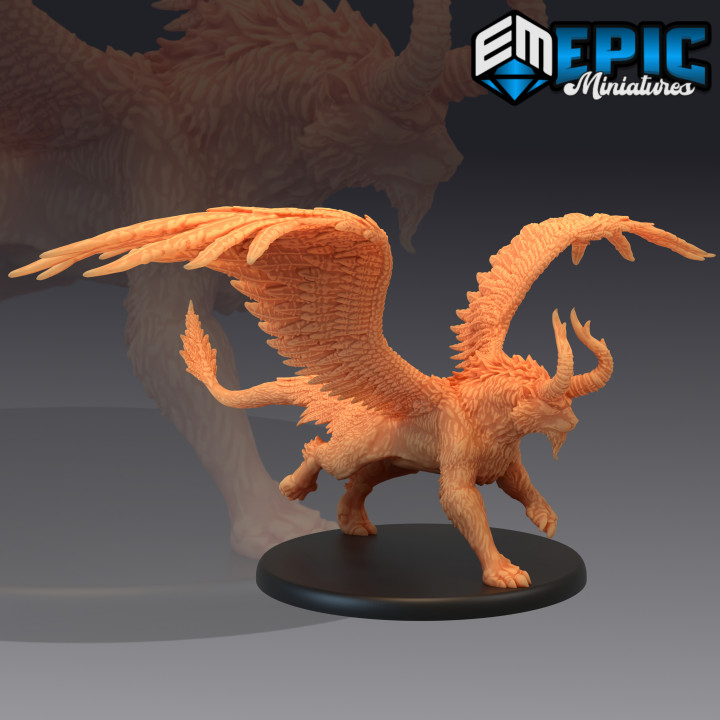
You are a GUI agent. You are given a task and a screenshot of the screen. Output one action in this format:
    pyautogui.click(x=<x>, y=<y>)
    Task: Click on the round stand
    Image resolution: width=720 pixels, height=720 pixels.
    Given the screenshot: What is the action you would take?
    pyautogui.click(x=454, y=584)